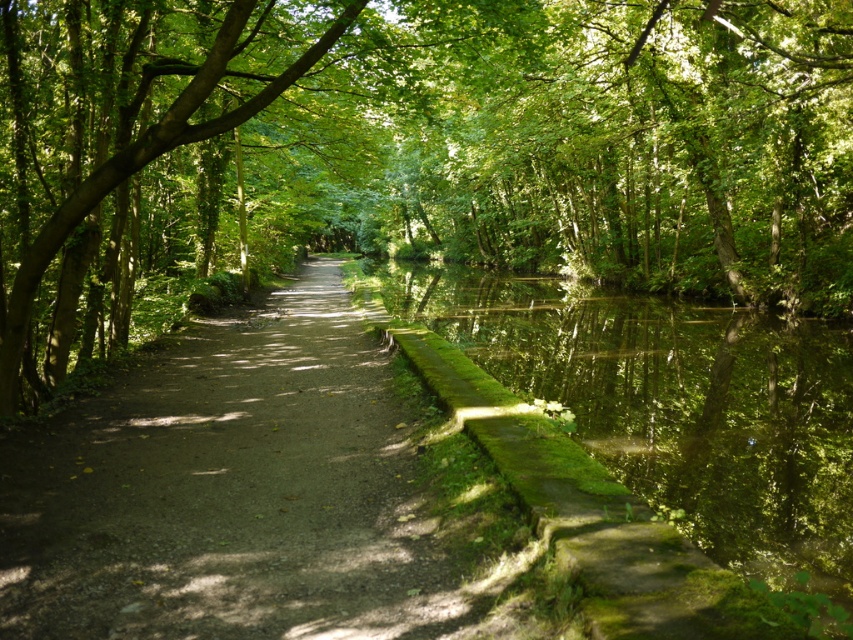
You are a hiker planning to take a photo of the dirt path at center and the green leafy tree at center from a position where both are visible. Based on their heights, which object will appear larger in the photo?

The green leafy tree at center is taller than the dirt path at center, so it will appear larger in the photo.

You are a hiker carrying a large backpack and want to walk along the dirt path at center. There is a green leafy tree at center nearby. Do you think the path is wide enough for you to walk comfortably without brushing against the tree?

The green leafy tree at center might be wider than the dirt path at center, so there is a possibility that the path may not be wide enough for comfortable passage without coming into contact with the tree.